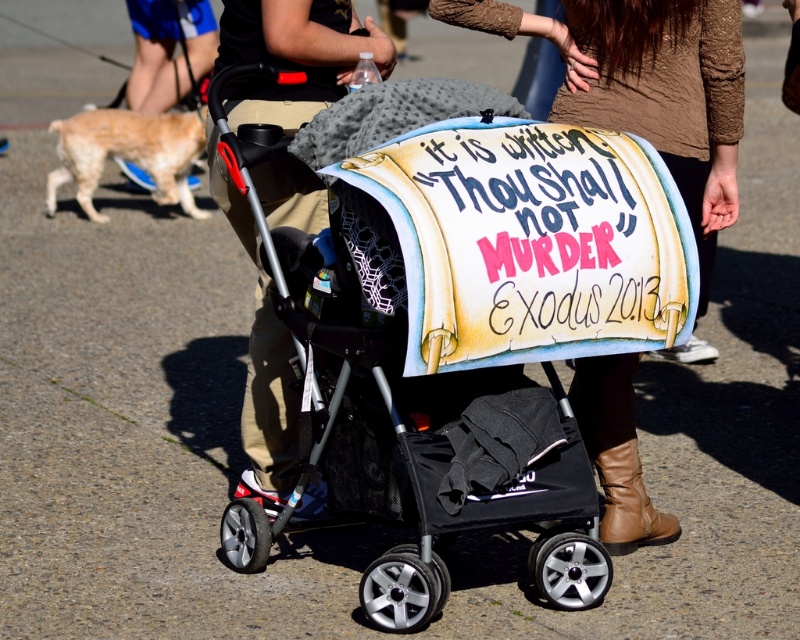
You are a delivery person standing in front of the black fabric baby carriage at center. You need to place a package on the ground 10 feet away from the carriage. Can you reach the spot without moving the carriage?

The distance between the black fabric baby carriage at center and the viewer is 15.94 feet. Since the package needs to be placed 10 feet away from the carriage, you are within the required distance and can reach the spot without moving the carriage.

Looking at this image, you are a photographer trying to capture a clear photo of the sign on the stroller. You notice the tan leather boot at lower right might block the view. Based on their sizes, will the boot obscure the sign on the black fabric baby carriage at center?

The black fabric baby carriage at center is taller than the tan leather boot at lower right, so the boot will not obscure the sign on the black fabric baby carriage at center.